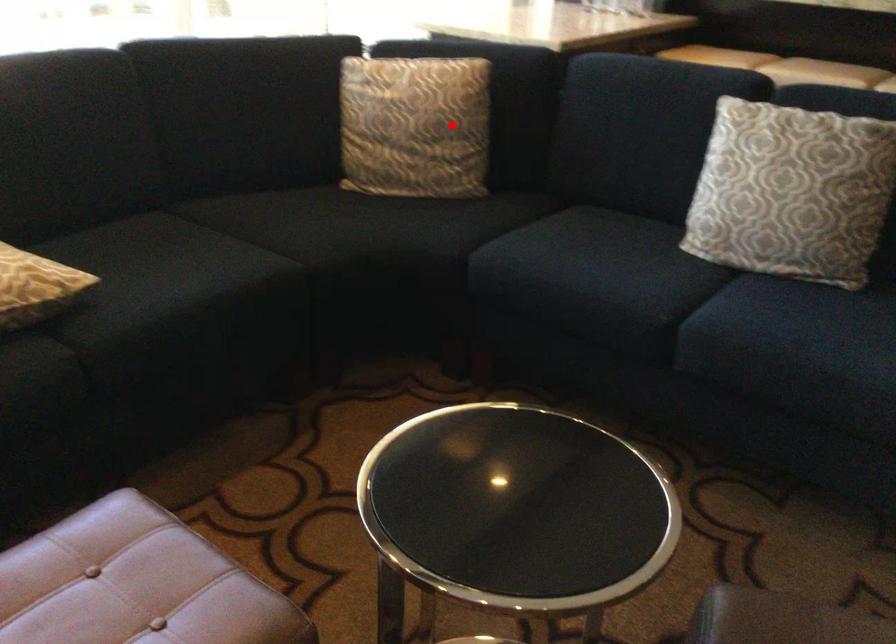
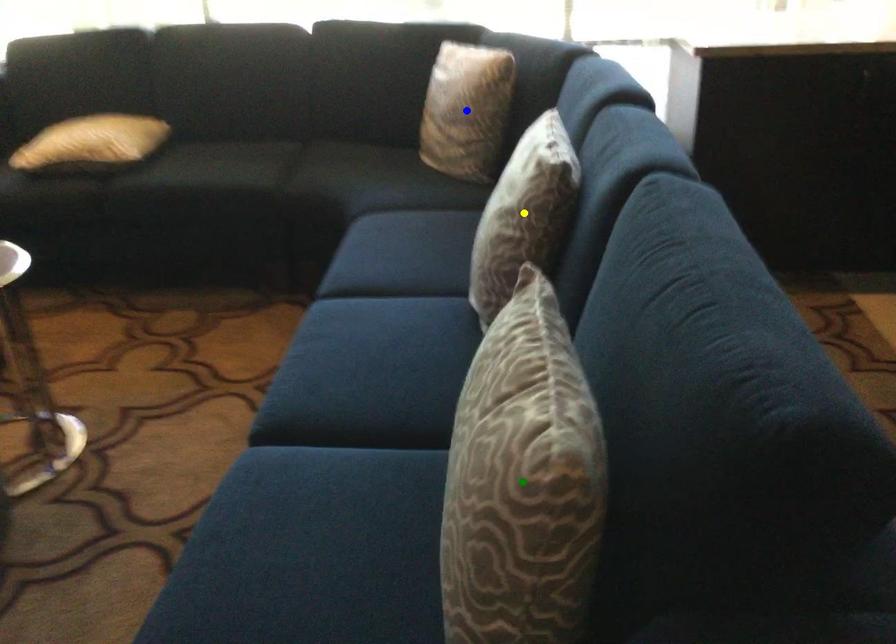
Question: I am providing you with two images of the same scene from different viewpoints. A red point is marked on the first image. You are given multiple points on the second image. Which point in image 2 is actually the same real-world point as the red point in image 1?

Choices:
 (A) blue point
 (B) yellow point
 (C) green point

Answer: (A)